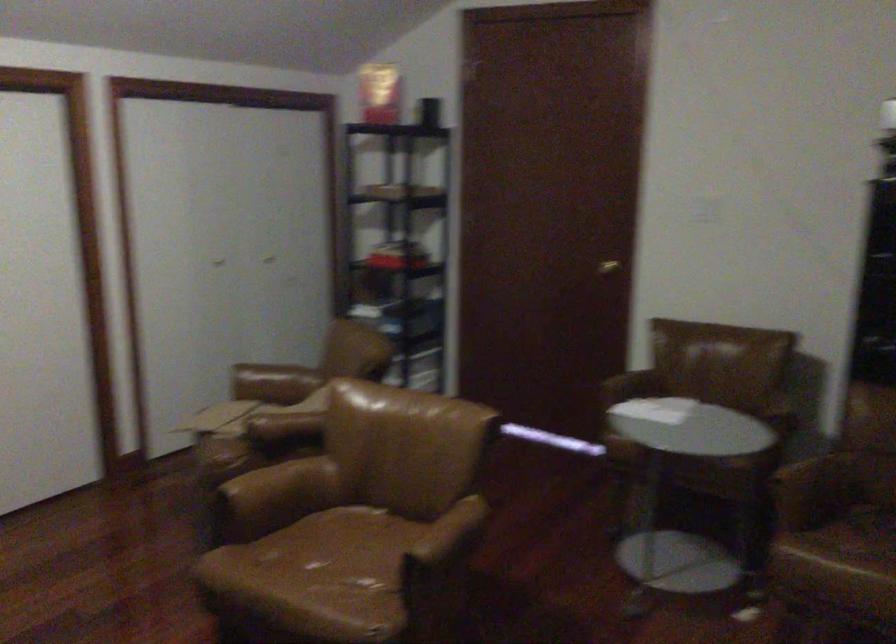
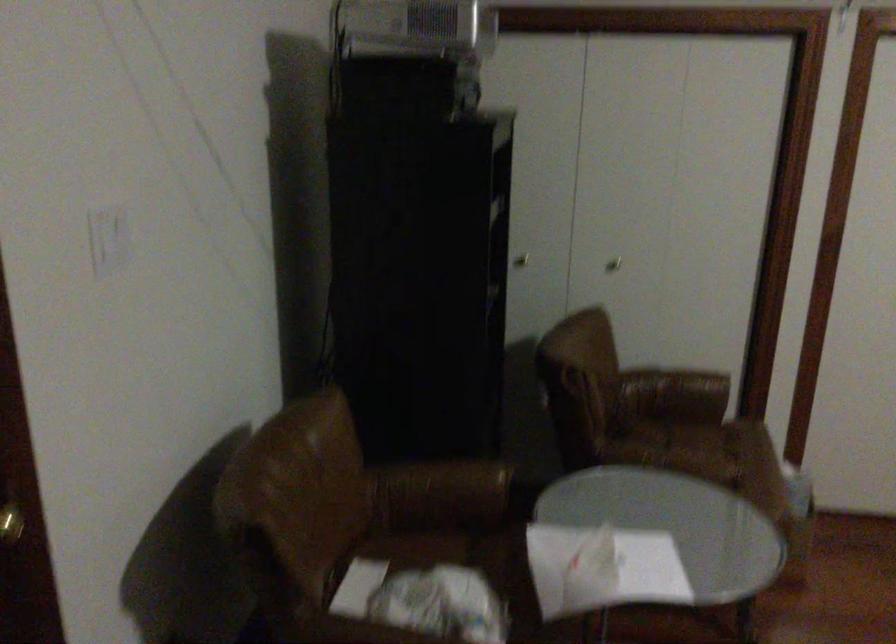
Locate, in the second image, the point that corresponds to (779,404) in the first image.

(442, 488)